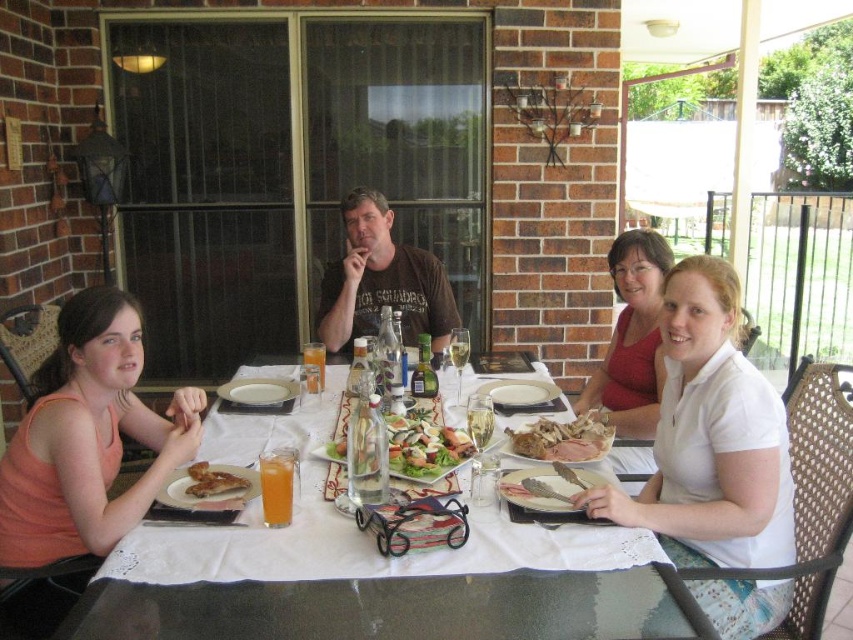
You are a waiter at this outdoor dining table. You need to place a new dessert plate on the table without covering any existing items. Considering the size of the white cloth table at center and the matte white shirt at center, where should you place the dessert plate?

The white cloth table at center is larger in size than the matte white shirt at center, so you should place the dessert plate on the white cloth table at center to ensure there is enough space without covering existing items.

You are a waiter at the outdoor dining area and need to deliver a drink to the person wearing the brown cotton shirt at center and the matte white shirt at center. Which one is closer to you so you can serve them first?

The brown cotton shirt at center is closer to you than the matte white shirt at center, so you should serve them first.